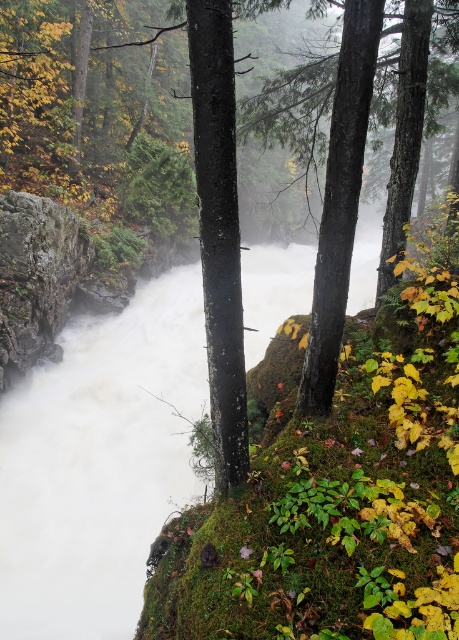
Consider the image. You are a hiker in the forest and want to identify the tallest tree between the smooth black tree trunk at center and the smooth bark tree at center. Which one should you choose?

The smooth black tree trunk at center is taller than the smooth bark tree at center, so you should choose the smooth black tree trunk at center.

You are a hiker trying to navigate through the forest. You see two trees in the center of the image, the smooth black tree trunk at center and the smooth bark tree at center. Which one is positioned to the left?

The smooth black tree trunk at center is positioned to the left of the smooth bark tree at center.

You are a hiker navigating through the misty forest and see the smooth bark tree at center and the green rough bark tree at center. Which tree is positioned lower in the scene?

The smooth bark tree at center is positioned lower than the green rough bark tree at center in the scene.